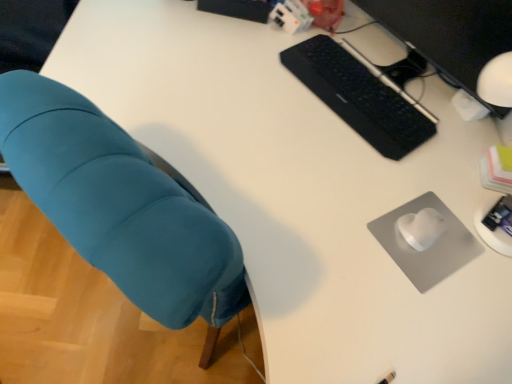
Question: In the image, is teal fabric chair at left on the left side or the right side of black matte keyboard at upper right?

Choices:
 (A) left
 (B) right

Answer: (A)

Question: Would you say teal fabric chair at left is inside or outside black matte keyboard at upper right?

Choices:
 (A) inside
 (B) outside

Answer: (B)

Question: Estimate the real-world distances between objects in this image. Which object is closer to the black matte computer monitor at upper right?

Choices:
 (A) black matte keyboard at upper right
 (B) teal fabric chair at left
 (C) gray matte mousepad at lower right

Answer: (A)

Question: Estimate the real-world distances between objects in this image. Which object is farther from the black matte computer monitor at upper right?

Choices:
 (A) gray matte mousepad at lower right
 (B) black matte keyboard at upper right
 (C) teal fabric chair at left

Answer: (C)